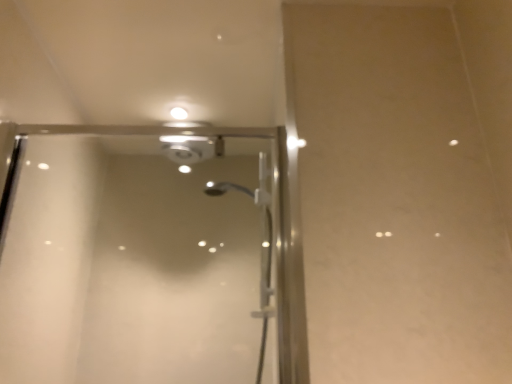
Describe the element at coordinates (137, 254) in the screenshot. I see `transparent glass shower door at center` at that location.

In order to click on transparent glass shower door at center in this screenshot , I will do `click(137, 254)`.

Where is `matte white droplight at upper center`? The height and width of the screenshot is (384, 512). matte white droplight at upper center is located at coordinates (179, 113).

What do you see at coordinates (179, 113) in the screenshot? The width and height of the screenshot is (512, 384). I see `matte white droplight at upper center` at bounding box center [179, 113].

Where is `transparent glass shower door at center`? The width and height of the screenshot is (512, 384). transparent glass shower door at center is located at coordinates pos(137,254).

Which is more to the right, matte white droplight at upper center or transparent glass shower door at center?

transparent glass shower door at center.

Does matte white droplight at upper center come behind transparent glass shower door at center?

Yes, it is behind transparent glass shower door at center.

Which is farther from the camera, (186, 110) or (6, 345)?

The point (186, 110) is behind.

From the image's perspective, is matte white droplight at upper center above or below transparent glass shower door at center?

matte white droplight at upper center is above transparent glass shower door at center.

From a real-world perspective, who is located higher, matte white droplight at upper center or transparent glass shower door at center?

From a 3D spatial view, matte white droplight at upper center is above.

Considering the sizes of objects matte white droplight at upper center and transparent glass shower door at center in the image provided, who is thinner, matte white droplight at upper center or transparent glass shower door at center?

matte white droplight at upper center.

Between matte white droplight at upper center and transparent glass shower door at center, which one has more height?

transparent glass shower door at center.

Between matte white droplight at upper center and transparent glass shower door at center, which one has larger size?

With larger size is transparent glass shower door at center.

Is matte white droplight at upper center inside or outside of transparent glass shower door at center?

matte white droplight at upper center is not inside transparent glass shower door at center, it's outside.

From the picture: Is matte white droplight at upper center positioned far away from transparent glass shower door at center?

matte white droplight at upper center is near transparent glass shower door at center, not far away.

Could you tell me if matte white droplight at upper center is facing transparent glass shower door at center?

No, matte white droplight at upper center is not facing towards transparent glass shower door at center.

Locate an element on the screen. The image size is (512, 384). screen door in front of the matte white droplight at upper center is located at coordinates (137, 254).

Considering the positions of objects transparent glass shower door at center and matte white droplight at upper center in the image provided, who is more to the right, transparent glass shower door at center or matte white droplight at upper center?

transparent glass shower door at center.

Looking at this image, relative to matte white droplight at upper center, is transparent glass shower door at center in front or behind?

transparent glass shower door at center is positioned closer to the viewer than matte white droplight at upper center.

Between point (138, 368) and point (177, 118), which one is positioned in front?

The point (138, 368) is more forward.

From the image's perspective, between transparent glass shower door at center and matte white droplight at upper center, who is located below?

transparent glass shower door at center is shown below in the image.

From a real-world perspective, which object rests below the other?

From a 3D spatial view, transparent glass shower door at center is below.

Considering the sizes of objects transparent glass shower door at center and matte white droplight at upper center in the image provided, who is thinner, transparent glass shower door at center or matte white droplight at upper center?

matte white droplight at upper center.

In terms of height, does transparent glass shower door at center look taller or shorter compared to matte white droplight at upper center?

Clearly, transparent glass shower door at center is taller compared to matte white droplight at upper center.

Based on their sizes in the image, would you say transparent glass shower door at center is bigger or smaller than matte white droplight at upper center?

Considering their sizes, transparent glass shower door at center takes up more space than matte white droplight at upper center.

Is matte white droplight at upper center located within transparent glass shower door at center?

No, transparent glass shower door at center does not contain matte white droplight at upper center.

Consider the image. Is transparent glass shower door at center next to matte white droplight at upper center and touching it?

They are not placed beside each other.

Is transparent glass shower door at center turned away from matte white droplight at upper center?

No, transparent glass shower door at center is not facing the opposite direction of matte white droplight at upper center.

The width and height of the screenshot is (512, 384). I want to click on droplight above the transparent glass shower door at center (from a real-world perspective), so click(x=179, y=113).

Locate an element on the screen. This screenshot has width=512, height=384. droplight above the transparent glass shower door at center (from a real-world perspective) is located at coordinates (179, 113).

Where is `droplight that is on the left side of transparent glass shower door at center`? The width and height of the screenshot is (512, 384). droplight that is on the left side of transparent glass shower door at center is located at coordinates (179, 113).